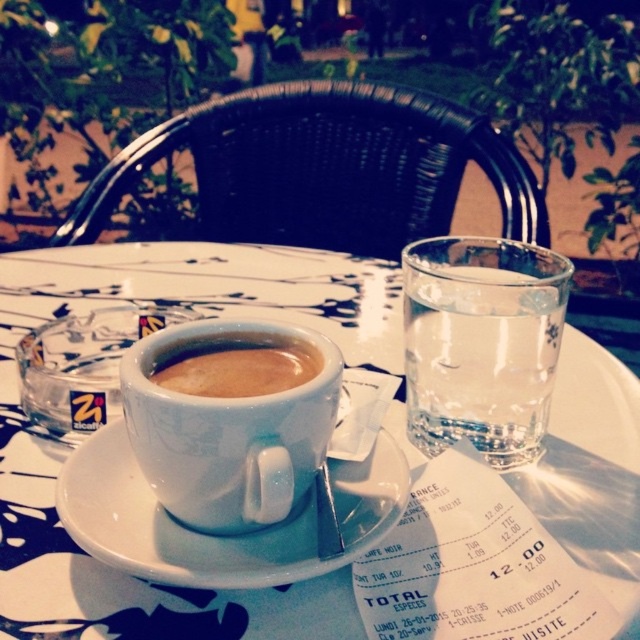
Can you confirm if white ceramic cup at center is shorter than white glossy mug at center?

Incorrect, white ceramic cup at center's height does not fall short of white glossy mug at center's.

Between white ceramic cup at center and white glossy mug at center, which one is positioned lower?

white glossy mug at center is lower down.

This screenshot has width=640, height=640. Find the location of `white ceramic cup at center`. white ceramic cup at center is located at coordinates (68, 449).

Does white glossy mug at center have a larger size compared to white matte cup of coffee at center?

Indeed, white glossy mug at center has a larger size compared to white matte cup of coffee at center.

Is white glossy mug at center above white matte cup of coffee at center?

Actually, white glossy mug at center is below white matte cup of coffee at center.

Locate an element on the screen. The height and width of the screenshot is (640, 640). white glossy mug at center is located at coordinates (228, 426).

Does white ceramic saucer at center have a lesser height compared to white matte cup of coffee at center?

No, white ceramic saucer at center is not shorter than white matte cup of coffee at center.

From the picture: Which of these two, white ceramic saucer at center or white matte cup of coffee at center, stands taller?

Standing taller between the two is white ceramic saucer at center.

The width and height of the screenshot is (640, 640). What do you see at coordinates (218, 536) in the screenshot? I see `white ceramic saucer at center` at bounding box center [218, 536].

Where is `white ceramic saucer at center`? Image resolution: width=640 pixels, height=640 pixels. white ceramic saucer at center is located at coordinates (218, 536).